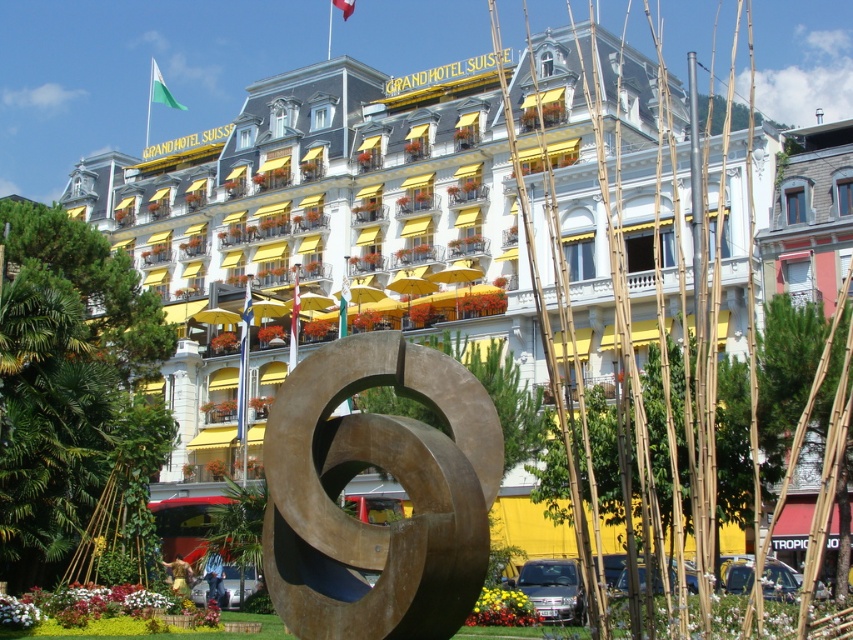
You are standing in front of the GRAND HOTEL SUISSE and want to take a photo that includes both the point at coordinates point (265,365) and the point at coordinates point (480,481). Which point should you focus on first to ensure both are in focus?

You should focus on point (265,365) first because it is closer to you than point (480,481), ensuring both points are within the depth of field.

You are standing in front of the GRAND HOTEL SUISSE and want to take a photo that includes both the white stone building at center and the bronze sculpture at center. Which object should you focus on first to ensure both are in frame?

You should focus on the bronze sculpture at center first because the white stone building at center is above it, so adjusting the camera angle to include the building might require a wider or upward tilt while keeping the sculpture in view.

You are standing at the entrance of the GRAND HOTEL SUISSE and want to take a photo of the white stone building at center. To ensure the building is in the frame, where should you position yourself relative to the sculpture?

You should position yourself so that the white stone building at center is centered in your viewfinder, as it is located at coordinates point [337,198] relative to the sculpture.